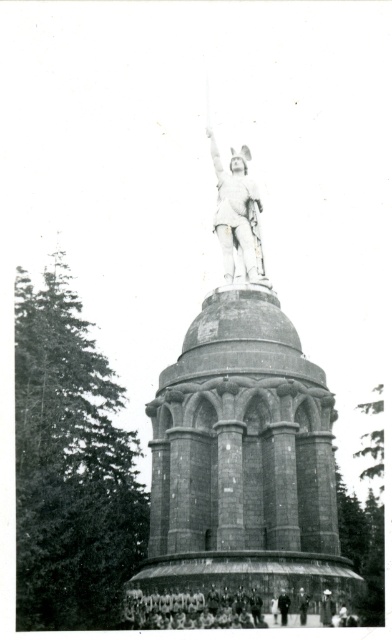
You are a photographer trying to capture the dark gray uniform at center in your shot without the white stone statue at center blocking it. Is this possible given their positions?

The dark gray uniform at center is behind the white stone statue at center, so it would be blocked from view. You cannot capture the dark gray uniform at center without the white stone statue at center blocking it.

You are a photographer standing at the edge of the circular platform where the white statue at center is located. You want to capture a photo that includes both the statue and the group of people below. Based on the statue and people positions, where should you position yourself to include both in the frame?

Since the white statue at center is positioned centrally on the dome, you should position yourself at the edge of the circular platform directly facing the statue. This central position will allow the statue to be the focal point while still capturing the group of people gathered below in the foreground.